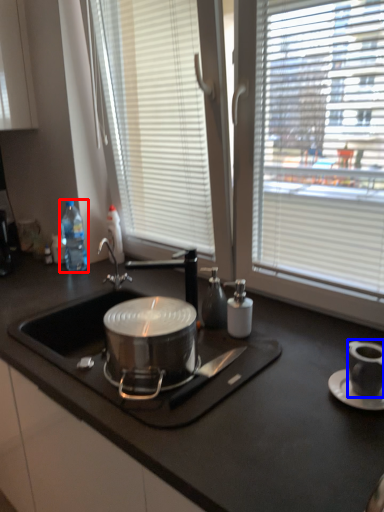
Question: Among these objects, which one is farthest to the camera, bottle (highlighted by a red box) or appliance (highlighted by a blue box)?

Choices:
 (A) bottle
 (B) appliance

Answer: (A)